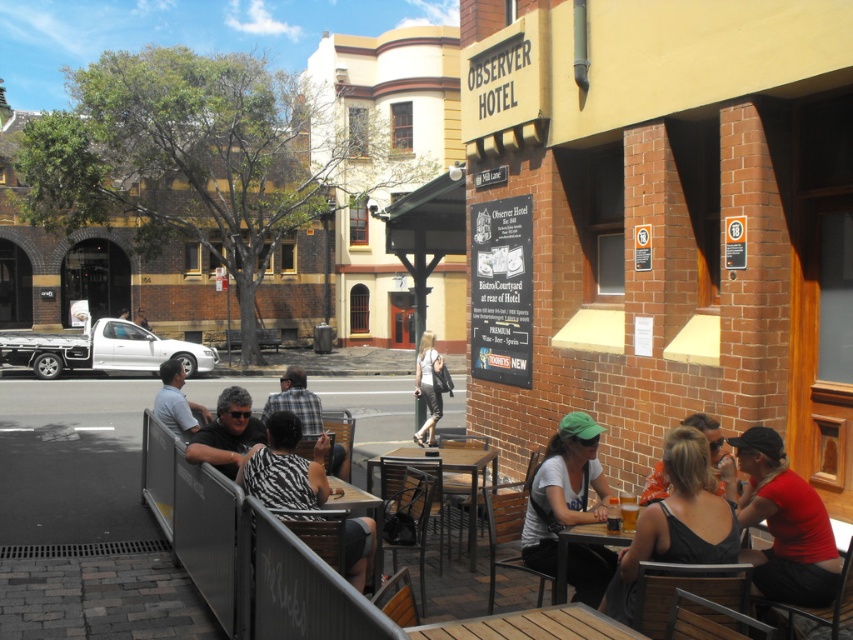
Question: Does wooden slats table at lower center have a lesser width compared to light brown leather jacket at center?

Choices:
 (A) no
 (B) yes

Answer: (A)

Question: Is matte white t-shirt at lower center wider than zebra-patterned shirt at center?

Choices:
 (A) yes
 (B) no

Answer: (B)

Question: Is orange fabric shirt at center bigger than light brown leather jacket at center?

Choices:
 (A) yes
 (B) no

Answer: (B)

Question: Which object is closer to the camera taking this photo?

Choices:
 (A) zebra-patterned shirt at center
 (B) matte red shirt at lower right
 (C) light brown leather jacket at center

Answer: (B)

Question: Which point is closer to the camera?

Choices:
 (A) black fabric tank top at lower right
 (B) zebra-patterned shirt at center

Answer: (A)

Question: Estimate the real-world distances between objects in this image. Which object is closer to the plaid shirt at center?

Choices:
 (A) light brown leather jacket at center
 (B) matte white t-shirt at lower center
 (C) orange fabric shirt at center
 (D) wooden table at lower center

Answer: (B)